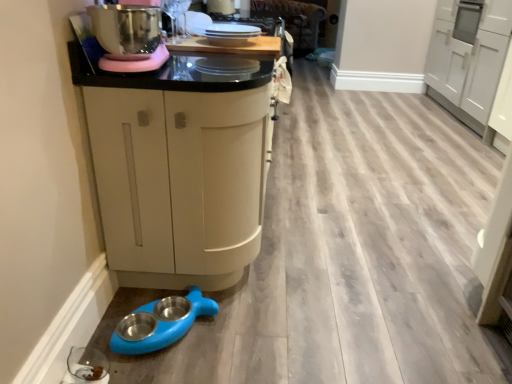
In order to click on space that is in front of blue rubber pet bowls at lower left in this screenshot , I will do pos(167,365).